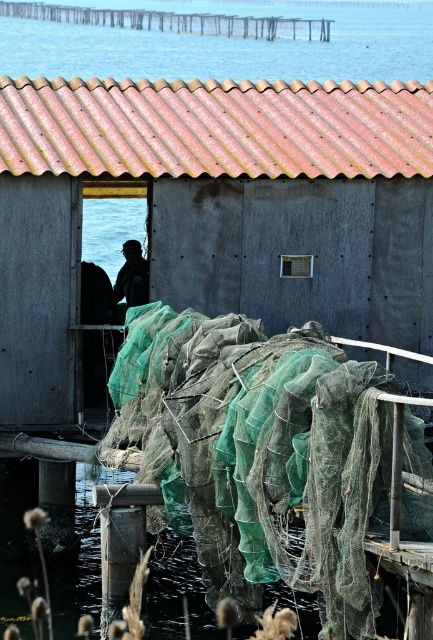
What do you see at coordinates (213, 211) in the screenshot? I see `rustic corrugated metal hut at center` at bounding box center [213, 211].

Which of these two, rustic corrugated metal hut at center or dark blue fabric fisherman at center, stands taller?

dark blue fabric fisherman at center

Does point (155, 248) come closer to viewer compared to point (148, 275)?

Yes, point (155, 248) is in front of point (148, 275).

Where is `rustic corrugated metal hut at center`? This screenshot has width=433, height=640. rustic corrugated metal hut at center is located at coordinates (213, 211).

Who is lower down, transparent blue water at upper center or dark blue fabric fisherman at center?

dark blue fabric fisherman at center is lower down.

What do you see at coordinates (230, 48) in the screenshot? This screenshot has height=640, width=433. I see `transparent blue water at upper center` at bounding box center [230, 48].

What do you see at coordinates (230, 48) in the screenshot? The image size is (433, 640). I see `transparent blue water at upper center` at bounding box center [230, 48].

Find the location of `transparent blue water at upper center`. transparent blue water at upper center is located at coordinates (230, 48).

Is point (31, 324) closer to viewer compared to point (275, 54)?

That is True.

Image resolution: width=433 pixels, height=640 pixels. I want to click on rustic corrugated metal hut at center, so click(x=213, y=211).